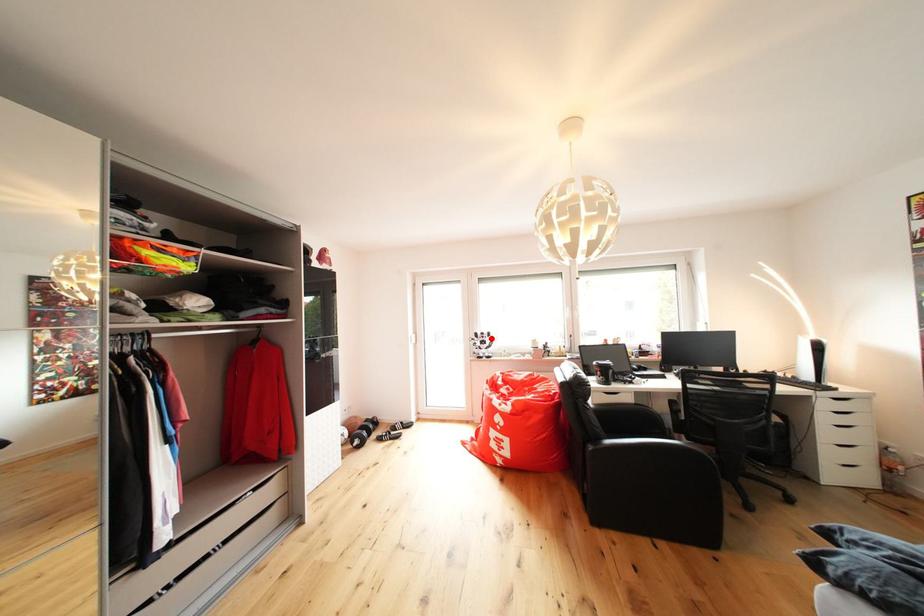
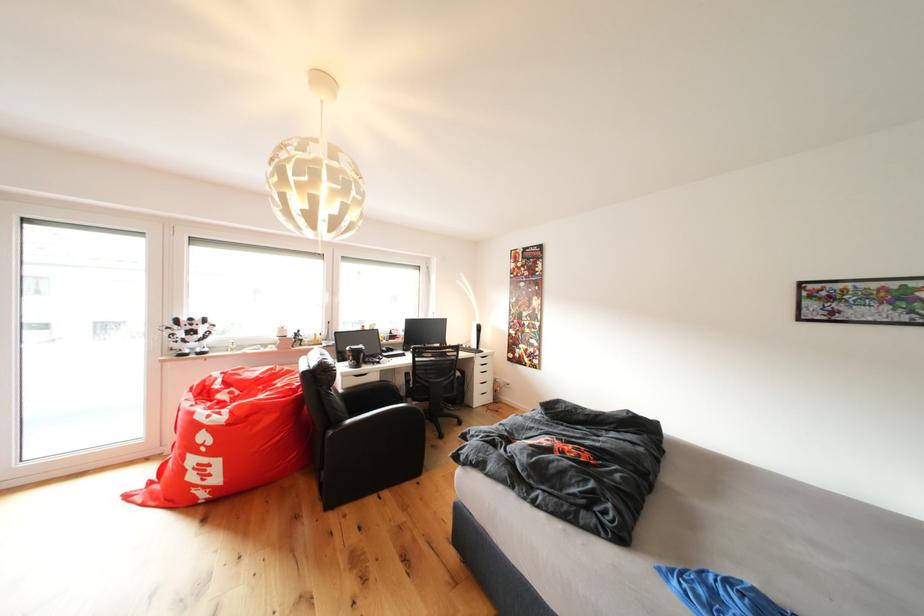
Where in the second image is the point corresponding to the highlighted location from the first image?

(200, 323)